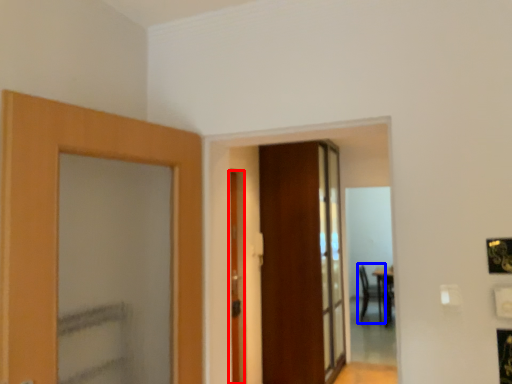
Question: Among these objects, which one is nearest to the camera, door (highlighted by a red box) or armchair (highlighted by a blue box)?

Choices:
 (A) door
 (B) armchair

Answer: (A)